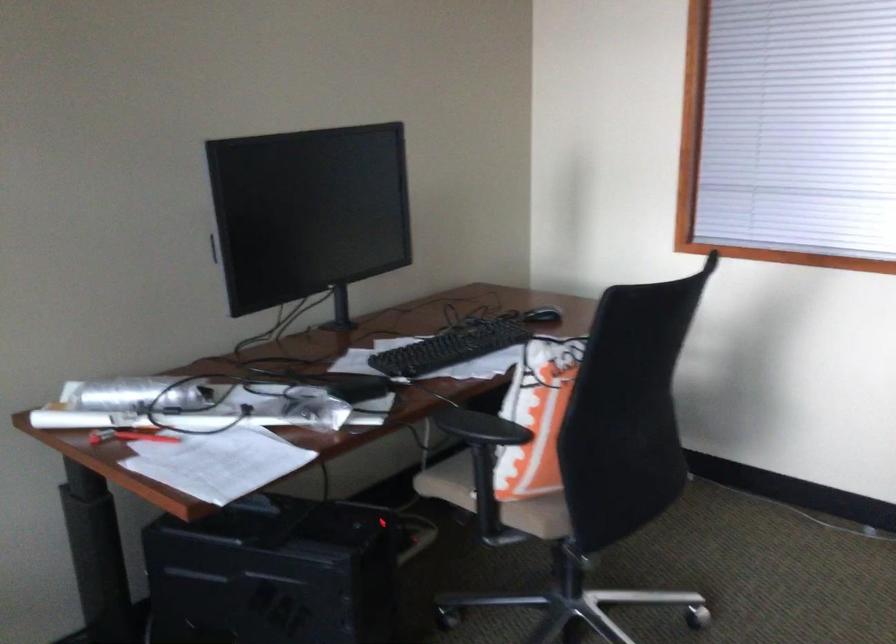
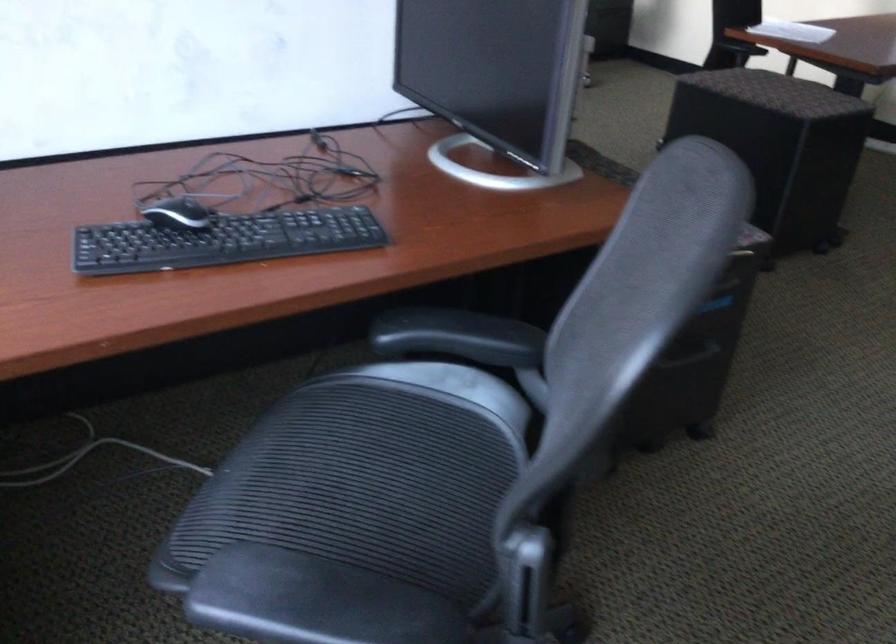
Question: What movement of the cameraman would produce the second image?

Choices:
 (A) Left
 (B) Right
 (C) Forward
 (D) Backward

Answer: (D)